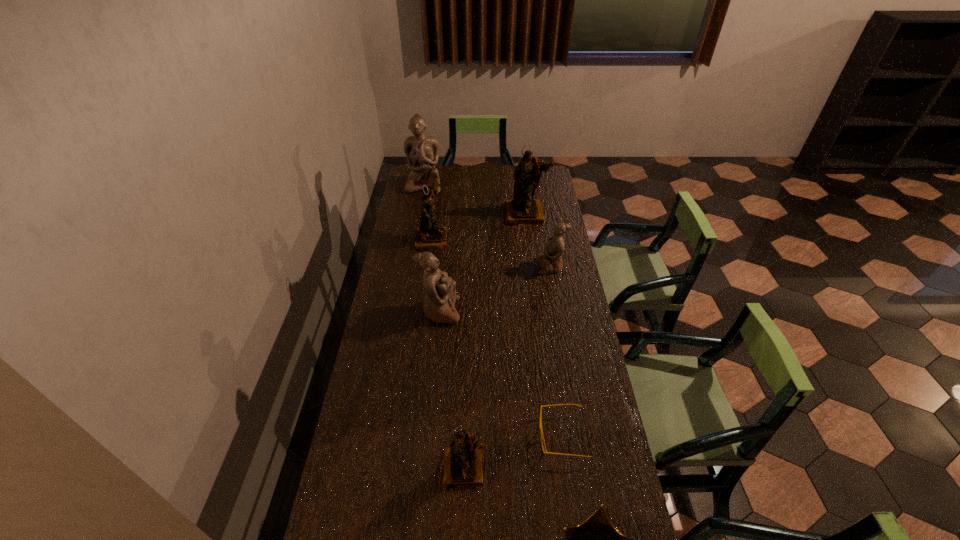
This screenshot has width=960, height=540. In order to click on figurine that stands as the closest to the fifth farthest object in this screenshot , I will do `click(429, 236)`.

Identify which figurine is located as the fifth nearest to the nearest white figurine. Please provide its 2D coordinates. Your answer should be formatted as a tuple, i.e. [(x, y)], where the tuple contains the x and y coordinates of a point satisfying the conditions above.

[(422, 152)]

Locate an element on the screen. This screenshot has height=540, width=960. white figurine that stands as the second closest to the rightmost white figurine is located at coordinates (422, 152).

In order to click on the second closest white figurine to the farthest object in this screenshot , I will do `click(440, 296)`.

Where is `gold figurine identified as the second closest to the farthest white figurine`? Image resolution: width=960 pixels, height=540 pixels. gold figurine identified as the second closest to the farthest white figurine is located at coordinates (523, 209).

Select which gold figurine is the second closest to the gold crown. Please provide its 2D coordinates. Your answer should be formatted as a tuple, i.e. [(x, y)], where the tuple contains the x and y coordinates of a point satisfying the conditions above.

[(429, 236)]

Image resolution: width=960 pixels, height=540 pixels. In order to click on free spot that satisfies the following two spatial constraints: 1. on the front-facing side of the second farthest white figurine; 2. on the front-facing side of the smallest gold figurine in this screenshot , I will do `click(587, 468)`.